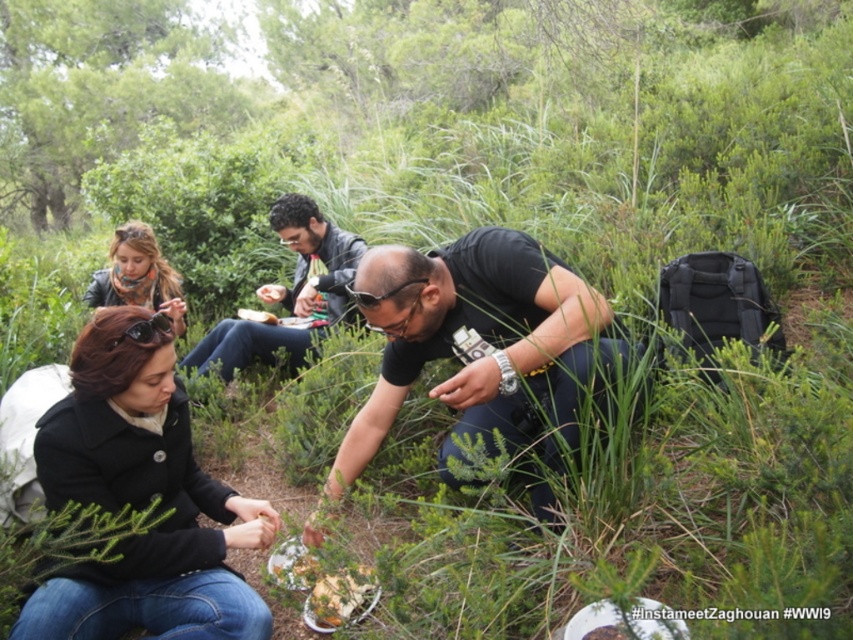
You are a photographer trying to capture a clear shot of the black matte coat at lower left and the matte black jacket at center. Since you want to focus on the taller object, which one should you adjust your camera to focus on?

The matte black jacket at center is taller than the black matte coat at lower left, so you should adjust your camera to focus on the matte black jacket at center.

Based on the scene description, can you determine the spatial relationship between the leather jacket at upper left and the white matte bread at center? Specifically, which object is positioned to the left of the other?

The leather jacket at upper left is positioned to the left of the white matte bread at center.